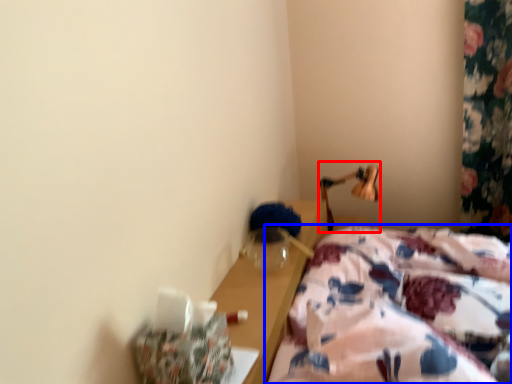
Question: Which of the following is the farthest to the observer, bedside lamp (highlighted by a red box) or bed (highlighted by a blue box)?

Choices:
 (A) bedside lamp
 (B) bed

Answer: (A)